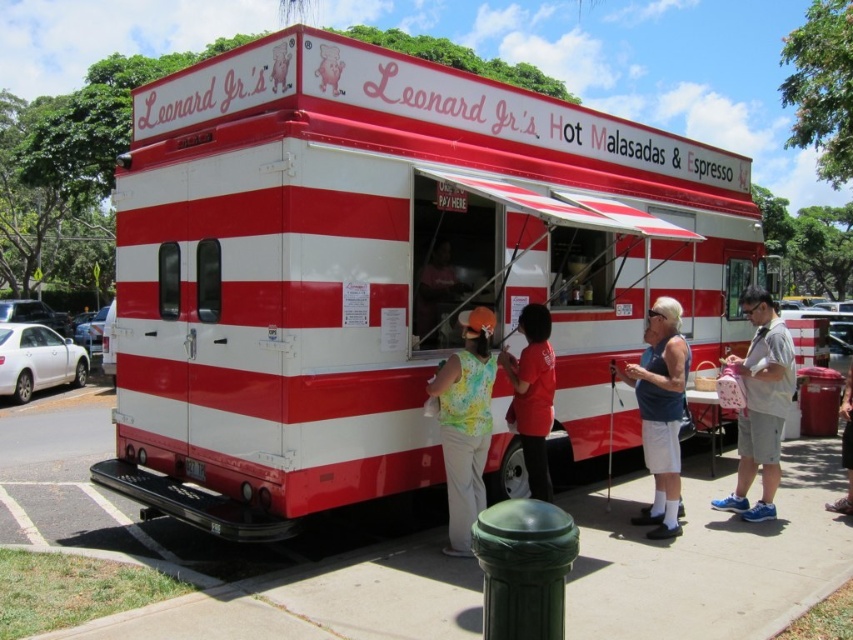
Between red and white striped food truck at center and floral sleeveless top at center, which one has more height?

red and white striped food truck at center

Locate an element on the screen. red and white striped food truck at center is located at coordinates (380, 268).

Where is `floral sleeveless top at center`? Image resolution: width=853 pixels, height=640 pixels. floral sleeveless top at center is located at coordinates (465, 422).

Which is behind, point (451, 378) or point (680, 352)?

The point (680, 352) is behind.

Describe the element at coordinates (465, 422) in the screenshot. I see `floral sleeveless top at center` at that location.

Find the location of a particular element. floral sleeveless top at center is located at coordinates (465, 422).

Can you confirm if light gray shorts at right is shorter than blue fabric tank top at center?

In fact, light gray shorts at right may be taller than blue fabric tank top at center.

Is light gray shorts at right smaller than blue fabric tank top at center?

Incorrect, light gray shorts at right is not smaller in size than blue fabric tank top at center.

Describe the element at coordinates (759, 404) in the screenshot. I see `light gray shorts at right` at that location.

Find the location of `light gray shorts at right`. light gray shorts at right is located at coordinates (759, 404).